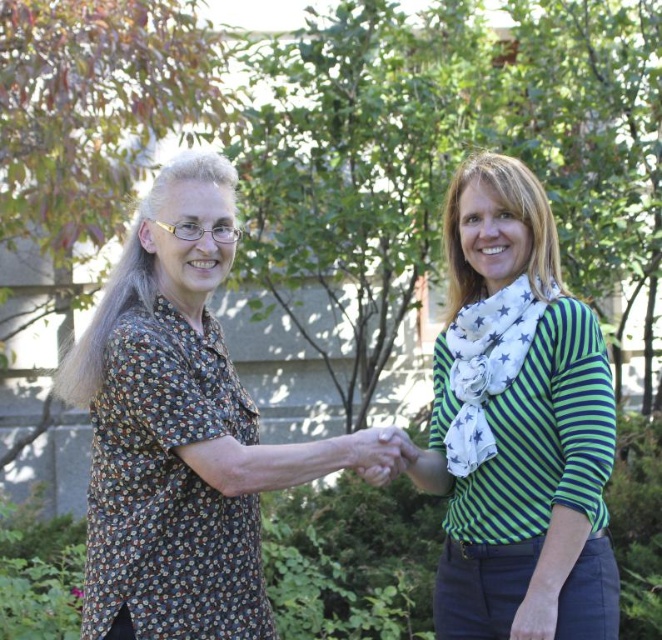
You are standing in the scene and want to place a small flag at the point that is closer to you. Which point should you choose between point (179, 554) and point (544, 333)?

You should choose point (179, 554) because it is closer to the viewer than point (544, 333).

You are a photographer standing in front of the scene. You want to take a photo of the green striped shirt at center and the smooth skin hand at center. Which object should you focus on first if you want to capture both in sharp focus?

The green striped shirt at center is much taller than the smooth skin hand at center, so you should focus on the green striped shirt at center first to ensure both are in sharp focus.